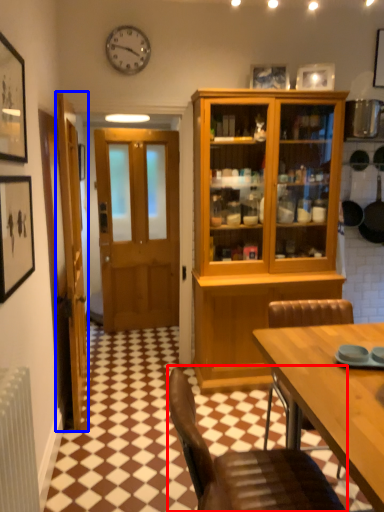
Question: Which of the following is the farthest to the observer, chair (highlighted by a red box) or door (highlighted by a blue box)?

Choices:
 (A) chair
 (B) door

Answer: (B)